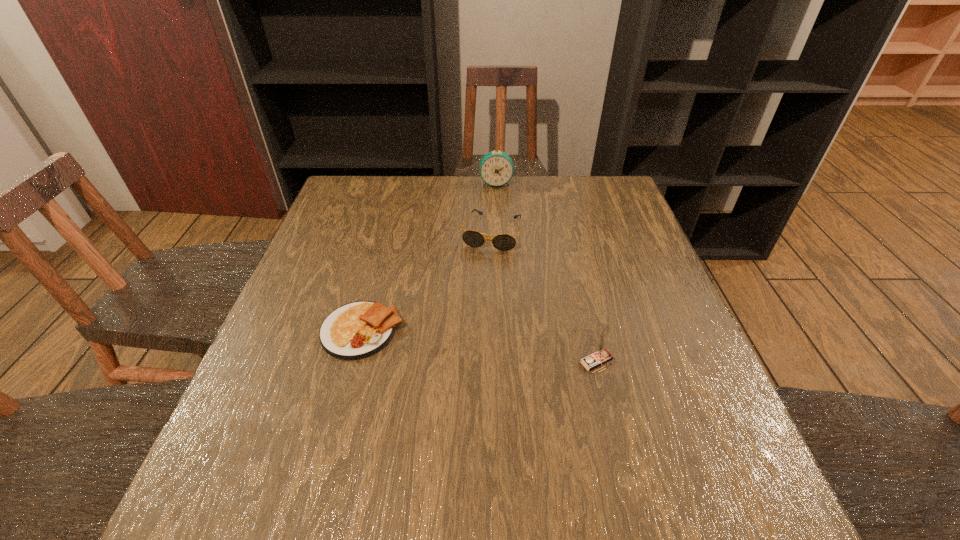
I want to click on vacant space at the right edge, so click(x=599, y=260).

Locate an element on the screen. Image resolution: width=960 pixels, height=540 pixels. blank space at the far left corner of the desktop is located at coordinates point(342,208).

This screenshot has width=960, height=540. Find the location of `blank space at the near left corner of the desktop`. blank space at the near left corner of the desktop is located at coordinates (256, 445).

Image resolution: width=960 pixels, height=540 pixels. Identify the location of vacant space that is in between the sunglasses and the omelet. (427, 281).

Locate an element on the screen. The height and width of the screenshot is (540, 960). vacant space in between the shortest object and the sunglasses is located at coordinates (427, 281).

This screenshot has width=960, height=540. I want to click on vacant space in between the rightmost object and the omelet, so click(480, 346).

Where is `free point between the sunglasses and the rightmost object`? Image resolution: width=960 pixels, height=540 pixels. free point between the sunglasses and the rightmost object is located at coordinates (544, 297).

You are a GUI agent. You are given a task and a screenshot of the screen. Output one action in this format:
    pyautogui.click(x=<x>, y=<y>)
    Task: Click on the free space that is in between the matchbox and the leftmost object
    This screenshot has width=960, height=540.
    Given the screenshot: What is the action you would take?
    pyautogui.click(x=480, y=346)

This screenshot has height=540, width=960. In order to click on blank region between the leftmost object and the alarm clock in this screenshot , I will do `click(429, 257)`.

This screenshot has width=960, height=540. In order to click on free spot between the matchbox and the alarm clock in this screenshot , I will do `click(546, 272)`.